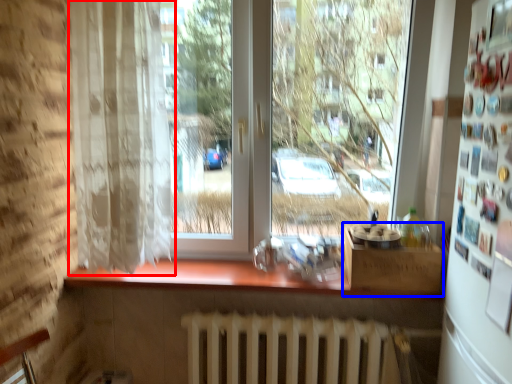
Question: Among these objects, which one is farthest to the camera, curtain (highlighted by a red box) or window box (highlighted by a blue box)?

Choices:
 (A) curtain
 (B) window box

Answer: (B)